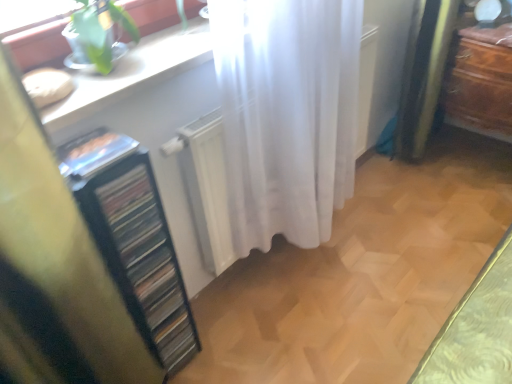
Question: Is point (117, 160) positioned closer to the camera than point (155, 82)?

Choices:
 (A) farther
 (B) closer

Answer: (B)

Question: From a real-world perspective, is black plastic file cabinet at left physically located above or below white glossy counter top at upper left?

Choices:
 (A) below
 (B) above

Answer: (A)

Question: Estimate the real-world distances between objects in this image. Which object is closer to the brown wooden dresser at right?

Choices:
 (A) white sheer curtain at center
 (B) black plastic file cabinet at left
 (C) white glossy counter top at upper left

Answer: (A)

Question: Based on their relative distances, which object is farther from the white glossy counter top at upper left?

Choices:
 (A) brown wooden dresser at right
 (B) white sheer curtain at center
 (C) black plastic file cabinet at left

Answer: (A)